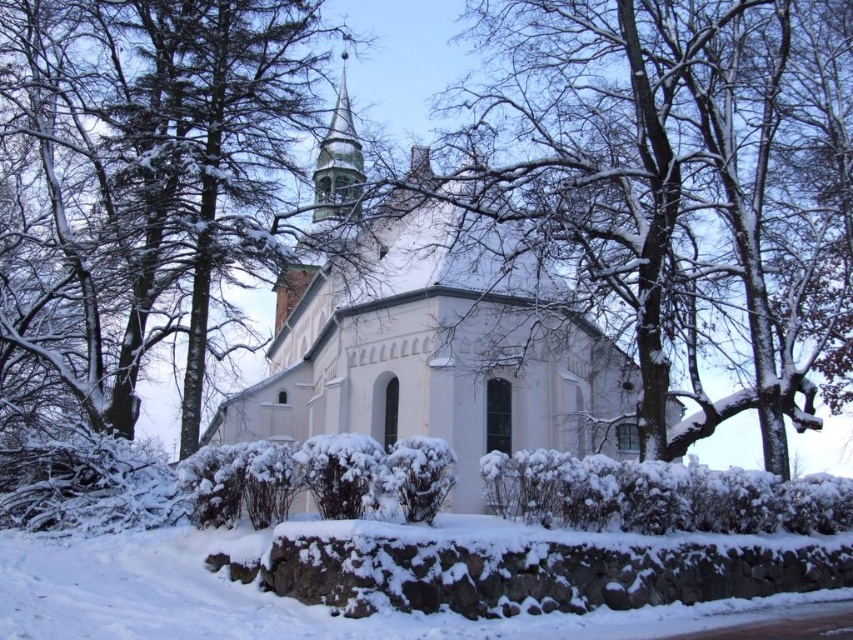
Is snow-covered pine tree at left to the left of snow-covered bark at center from the viewer's perspective?

Yes, snow-covered pine tree at left is to the left of snow-covered bark at center.

Based on the photo, is snow-covered pine tree at left thinner than snow-covered bark at center?

Yes, snow-covered pine tree at left is thinner than snow-covered bark at center.

Who is more forward, (132, 99) or (407, 93)?

Point (132, 99) is in front.

This screenshot has width=853, height=640. What are the coordinates of `snow-covered pine tree at left` in the screenshot? It's located at (155, 172).

Is white stone church at center taller than shiny silver spire at upper left?

Correct, white stone church at center is much taller as shiny silver spire at upper left.

What do you see at coordinates (437, 353) in the screenshot? I see `white stone church at center` at bounding box center [437, 353].

Does point (466, 227) lie in front of point (347, 204)?

Yes.

Identify the location of white stone church at center. (437, 353).

Looking at this image, does white stone church at center have a smaller size compared to snow-covered bark at center?

Actually, white stone church at center might be larger than snow-covered bark at center.

Between white stone church at center and snow-covered bark at center, which one has less height?

With less height is white stone church at center.

Which is in front, point (440, 298) or point (352, 83)?

Point (440, 298)

Locate an element on the screen. The image size is (853, 640). white stone church at center is located at coordinates [x=437, y=353].